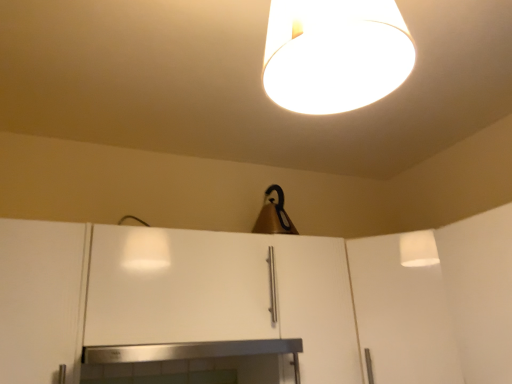
Question: Which direction should I rotate to look at white matte lampshade at upper center, marked as the second lamp in a bottom-to-top arrangement, — up or down?

Choices:
 (A) up
 (B) down

Answer: (A)

Question: Is white matte cabinet at left, which is the 1th cabinetry in left-to-right order, closer to camera compared to white matte cabinet at center, placed as the 1th cabinetry when sorted from right to left?

Choices:
 (A) no
 (B) yes

Answer: (B)

Question: From the image's perspective, is white matte cabinet at left, which is counted as the second cabinetry, starting from the right, located beneath white matte cabinet at center, which is counted as the 2th cabinetry, starting from the left?

Choices:
 (A) yes
 (B) no

Answer: (A)

Question: Is white matte cabinet at left, which is the 1th cabinetry in left-to-right order, at the right side of white matte cabinet at center, placed as the 1th cabinetry when sorted from right to left?

Choices:
 (A) no
 (B) yes

Answer: (A)

Question: Considering the relative positions of white matte cabinet at left, which is counted as the second cabinetry, starting from the right, and white matte cabinet at center, placed as the 1th cabinetry when sorted from right to left, in the image provided, is white matte cabinet at left, which is counted as the second cabinetry, starting from the right, to the left of white matte cabinet at center, placed as the 1th cabinetry when sorted from right to left, from the viewer's perspective?

Choices:
 (A) no
 (B) yes

Answer: (B)

Question: Considering the relative sizes of white matte cabinet at left, which is counted as the second cabinetry, starting from the right, and white matte cabinet at center, placed as the 1th cabinetry when sorted from right to left, in the image provided, is white matte cabinet at left, which is counted as the second cabinetry, starting from the right, taller than white matte cabinet at center, placed as the 1th cabinetry when sorted from right to left,?

Choices:
 (A) yes
 (B) no

Answer: (A)

Question: From a real-world perspective, is white matte cabinet at left, which is counted as the second cabinetry, starting from the right, below white matte cabinet at center, placed as the 1th cabinetry when sorted from right to left?

Choices:
 (A) yes
 (B) no

Answer: (A)

Question: Is stainless steel fireplace at center at the back of matte brown lampshade at upper center, which appears as the 1th lamp when ordered from the bottom?

Choices:
 (A) no
 (B) yes

Answer: (A)

Question: From the image's perspective, is matte brown lampshade at upper center, which appears as the 1th lamp when ordered from the bottom, located above stainless steel fireplace at center?

Choices:
 (A) yes
 (B) no

Answer: (A)

Question: Is matte brown lampshade at upper center, which is counted as the 2th lamp, starting from the front, in contact with stainless steel fireplace at center?

Choices:
 (A) no
 (B) yes

Answer: (A)

Question: Considering the relative sizes of matte brown lampshade at upper center, which is counted as the 2th lamp, starting from the front, and stainless steel fireplace at center in the image provided, is matte brown lampshade at upper center, which is counted as the 2th lamp, starting from the front, smaller than stainless steel fireplace at center?

Choices:
 (A) yes
 (B) no

Answer: (A)

Question: Is matte brown lampshade at upper center, which is the second lamp in top-to-bottom order, at the left side of stainless steel fireplace at center?

Choices:
 (A) yes
 (B) no

Answer: (B)

Question: Is matte brown lampshade at upper center, which is counted as the 2th lamp, starting from the front, positioned in front of stainless steel fireplace at center?

Choices:
 (A) yes
 (B) no

Answer: (B)

Question: Is white matte lampshade at upper center, the second lamp in the back-to-front sequence, a part of white matte cabinet at center, which is counted as the 2th cabinetry, starting from the left?

Choices:
 (A) yes
 (B) no

Answer: (B)